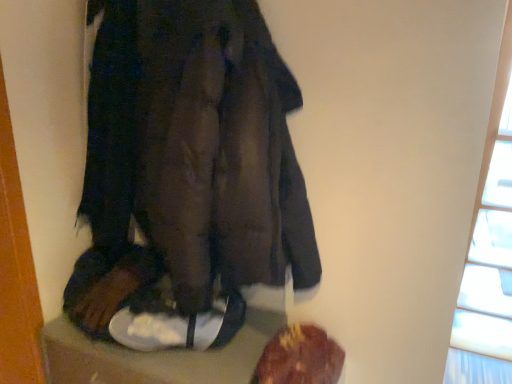
Question: Considering the positions of point (138, 99) and point (321, 336), is point (138, 99) closer or farther from the camera than point (321, 336)?

Choices:
 (A) closer
 (B) farther

Answer: (A)

Question: Considering the positions of dark brown leather coat at center and brown crumbly bread at lower right in the image, is dark brown leather coat at center bigger or smaller than brown crumbly bread at lower right?

Choices:
 (A) small
 (B) big

Answer: (B)

Question: Which object is the closest to the dark brown leather coat at center?

Choices:
 (A) brown crumbly bread at lower right
 (B) transparent glass window at upper right

Answer: (A)

Question: Which object is positioned farthest from the dark brown leather coat at center?

Choices:
 (A) brown crumbly bread at lower right
 (B) transparent glass window at upper right

Answer: (B)